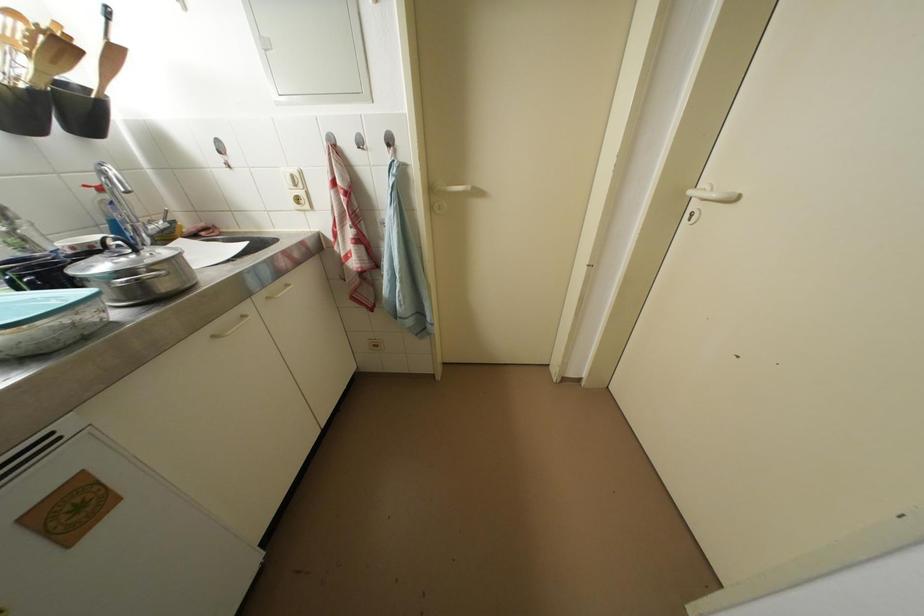
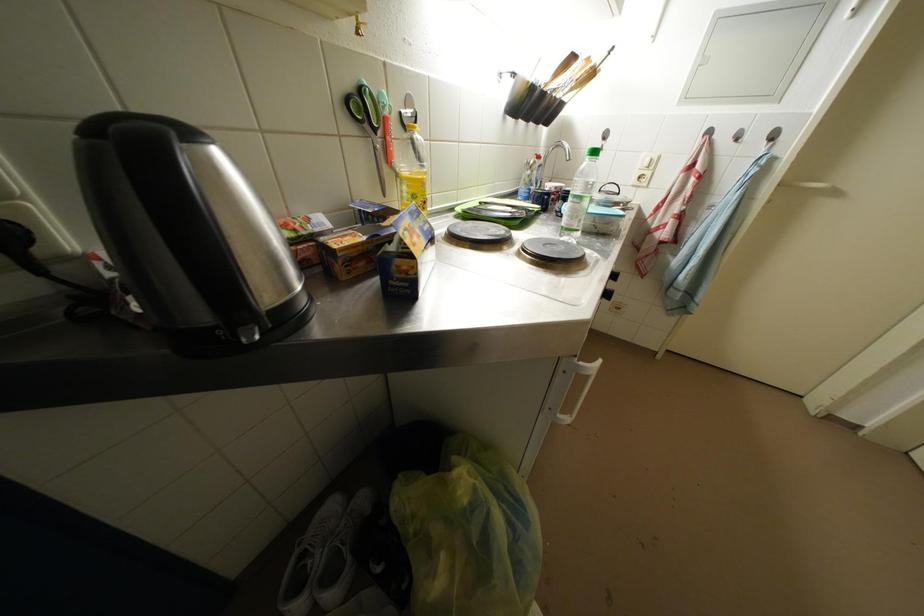
Question: The images are taken continuously from a first-person perspective. In which direction is your viewpoint rotating?

Choices:
 (A) Left
 (B) Right
 (C) Up
 (D) Down

Answer: (A)